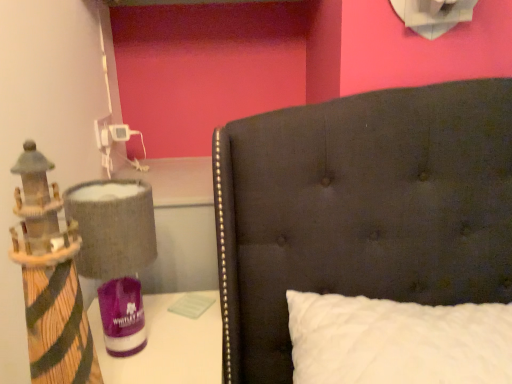
Question: Considering the positions of wooden lighthouse at left and white quilted pillow at center in the image, is wooden lighthouse at left taller or shorter than white quilted pillow at center?

Choices:
 (A) tall
 (B) short

Answer: (B)

Question: Based on their positions, is wooden lighthouse at left located to the left or right of white quilted pillow at center?

Choices:
 (A) left
 (B) right

Answer: (A)

Question: Which object is positioned closest to the white quilted pillow at center?

Choices:
 (A) textured fabric lampshade at left
 (B) wooden lighthouse at left

Answer: (A)

Question: Based on their relative distances, which object is nearer to the textured fabric lampshade at left?

Choices:
 (A) white quilted pillow at center
 (B) wooden lighthouse at left

Answer: (B)